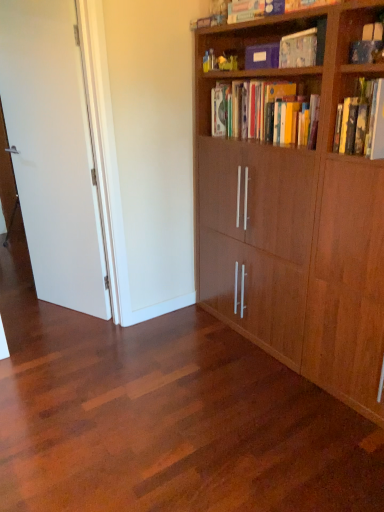
Question: Can you confirm if shiny wood floor at center is taller than white matte door at left?

Choices:
 (A) no
 (B) yes

Answer: (A)

Question: From a real-world perspective, is shiny wood floor at center located beneath white matte door at left?

Choices:
 (A) no
 (B) yes

Answer: (B)

Question: From a real-world perspective, is shiny wood floor at center on white matte door at left?

Choices:
 (A) yes
 (B) no

Answer: (B)

Question: Does shiny wood floor at center have a lesser width compared to white matte door at left?

Choices:
 (A) no
 (B) yes

Answer: (A)

Question: Is shiny wood floor at center behind white matte door at left?

Choices:
 (A) yes
 (B) no

Answer: (B)

Question: Is hardcover books at upper center, which is the 1th book in bottom-to-top order, bigger or smaller than matte blue book at upper center, arranged as the third book when ordered from the bottom?

Choices:
 (A) small
 (B) big

Answer: (B)

Question: Is hardcover books at upper center, which is the 1th book in bottom-to-top order, situated inside matte blue book at upper center, arranged as the third book when ordered from the bottom, or outside?

Choices:
 (A) outside
 (B) inside

Answer: (A)

Question: From a real-world perspective, is hardcover books at upper center, which is the 3th book from top to bottom, above or below matte blue book at upper center, arranged as the third book when ordered from the bottom?

Choices:
 (A) below
 (B) above

Answer: (A)

Question: In the image, is hardcover books at upper center, which is the 3th book from top to bottom, positioned in front of or behind matte blue book at upper center, arranged as the third book when ordered from the bottom?

Choices:
 (A) behind
 (B) front

Answer: (B)

Question: Is point (231, 17) positioned closer to the camera than point (205, 509)?

Choices:
 (A) closer
 (B) farther

Answer: (B)

Question: Visually, is matte blue book at upper center, arranged as the third book when ordered from the bottom, positioned to the left or to the right of shiny wood floor at center?

Choices:
 (A) right
 (B) left

Answer: (A)

Question: Considering the positions of matte blue book at upper center, which ranks as the first book in top-to-bottom order, and shiny wood floor at center in the image, is matte blue book at upper center, which ranks as the first book in top-to-bottom order, taller or shorter than shiny wood floor at center?

Choices:
 (A) tall
 (B) short

Answer: (A)

Question: In the image, is matte blue book at upper center, arranged as the third book when ordered from the bottom, positioned in front of or behind shiny wood floor at center?

Choices:
 (A) front
 (B) behind

Answer: (B)

Question: In terms of size, does matte blue book at upper center, which ranks as the first book in top-to-bottom order, appear bigger or smaller than wooden bookcase at right?

Choices:
 (A) big
 (B) small

Answer: (B)

Question: Is point (297, 8) positioned closer to the camera than point (319, 246)?

Choices:
 (A) farther
 (B) closer

Answer: (B)